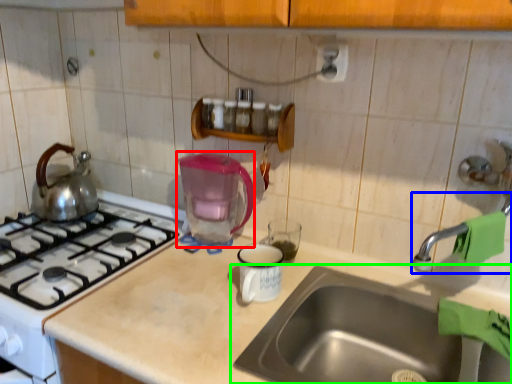
Question: Which object is positioned closest to coffeepot (highlighted by a red box)? Select from faucet (highlighted by a blue box) and sink (highlighted by a green box).

Choices:
 (A) faucet
 (B) sink

Answer: (B)